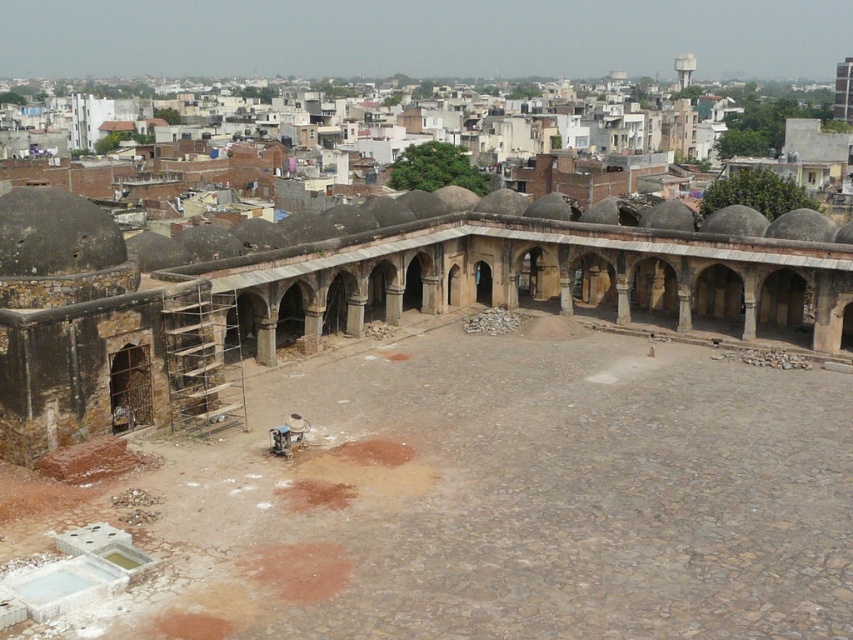
Based on the photo, is the position of stone paved courtyard at center more distant than that of brown stone courtyard at center?

No, stone paved courtyard at center is in front of brown stone courtyard at center.

The image size is (853, 640). Describe the element at coordinates (492, 499) in the screenshot. I see `stone paved courtyard at center` at that location.

The image size is (853, 640). I want to click on stone paved courtyard at center, so click(492, 499).